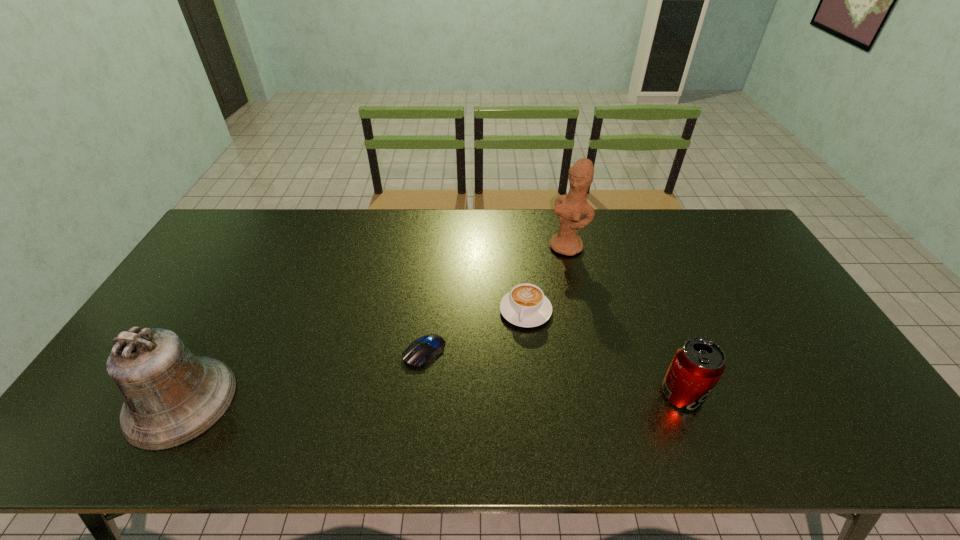
You are a GUI agent. You are given a task and a screenshot of the screen. Output one action in this format:
    pyautogui.click(x=<x>, y=<y>)
    Task: Click on the free point located 0.100m on the right of the fourth shortest object
    
    Given the screenshot: What is the action you would take?
    pyautogui.click(x=274, y=401)

I want to click on vacant space located 0.230m on the back of the third shortest object, so (650, 310).

You are a GUI agent. You are given a task and a screenshot of the screen. Output one action in this format:
    pyautogui.click(x=<x>, y=<y>)
    Task: Click on the free space located 0.230m on the side of the cappuccino with the handle
    The height and width of the screenshot is (540, 960).
    Given the screenshot: What is the action you would take?
    pyautogui.click(x=497, y=398)

Where is `vacant position located on the side of the cappuccino with the handle`? vacant position located on the side of the cappuccino with the handle is located at coordinates (496, 401).

The width and height of the screenshot is (960, 540). I want to click on free location located 0.180m on the side of the cappuccino with the handle, so click(x=503, y=381).

Find the location of a particular element. Image resolution: width=960 pixels, height=540 pixels. vacant space located on the button side of the fourth object from right to left is located at coordinates (344, 408).

Locate an element on the screen. The width and height of the screenshot is (960, 540). vacant area situated 0.100m on the button side of the fourth object from right to left is located at coordinates (375, 386).

Where is `free space located 0.060m on the button side of the fourth object from right to left`? The width and height of the screenshot is (960, 540). free space located 0.060m on the button side of the fourth object from right to left is located at coordinates (389, 377).

You are a GUI agent. You are given a task and a screenshot of the screen. Output one action in this format:
    pyautogui.click(x=<x>, y=<y>)
    Task: Click on the vacant region located 0.170m on the front-facing side of the farthest object
    
    Given the screenshot: What is the action you would take?
    pyautogui.click(x=529, y=285)

This screenshot has height=540, width=960. In order to click on free space located on the front-facing side of the farthest object in this screenshot , I will do `click(496, 316)`.